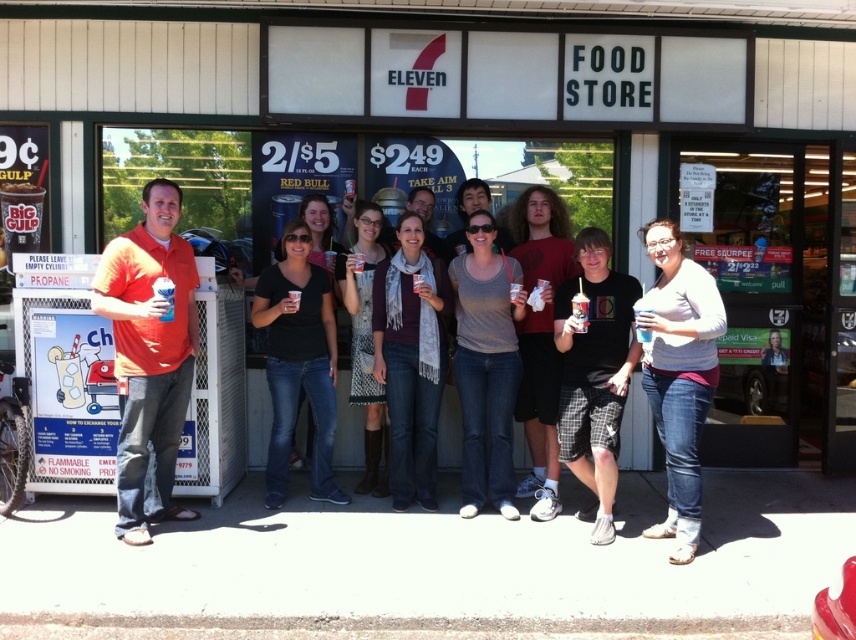
Between knit scarf at center and matte plastic cup at center, which one has more height?

With more height is knit scarf at center.

Between point (366, 429) and point (163, 298), which one is positioned behind?

The point (366, 429) is behind.

Is point (367, 328) closer to viewer compared to point (171, 291)?

No, it is not.

Locate an element on the screen. knit scarf at center is located at coordinates (364, 339).

In the scene shown: Between light gray sweater at center and black cotton t-shirt at center, which one is positioned lower?

black cotton t-shirt at center

Can you confirm if light gray sweater at center is taller than black cotton t-shirt at center?

Yes, light gray sweater at center is taller than black cotton t-shirt at center.

Is point (658, 291) closer to viewer compared to point (587, 397)?

Yes, it is in front of point (587, 397).

I want to click on light gray sweater at center, so click(x=679, y=376).

Measure the distance between gray matte shirt at center and gray scarf at center.

gray matte shirt at center and gray scarf at center are 12.07 inches apart.

Which is more to the left, gray matte shirt at center or gray scarf at center?

From the viewer's perspective, gray scarf at center appears more on the left side.

The image size is (856, 640). Identify the location of gray matte shirt at center. (486, 365).